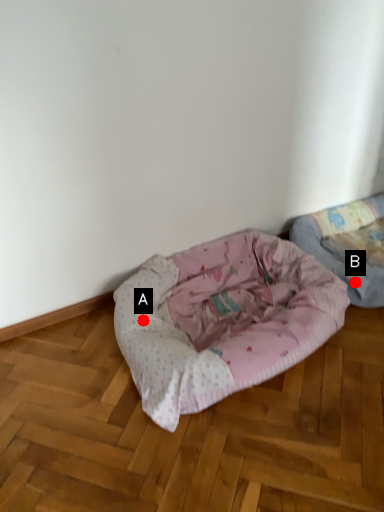
Question: Two points are circled on the image, labeled by A and B beside each circle. Which point is closer to the camera taking this photo?

Choices:
 (A) A is closer
 (B) B is closer

Answer: (A)